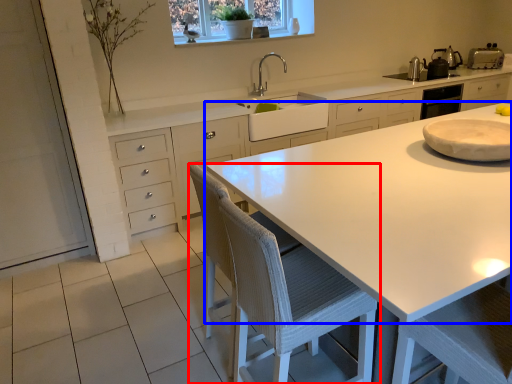
Question: Which object appears farthest to the camera in this image, chair (highlighted by a red box) or countertop (highlighted by a blue box)?

Choices:
 (A) chair
 (B) countertop

Answer: (A)